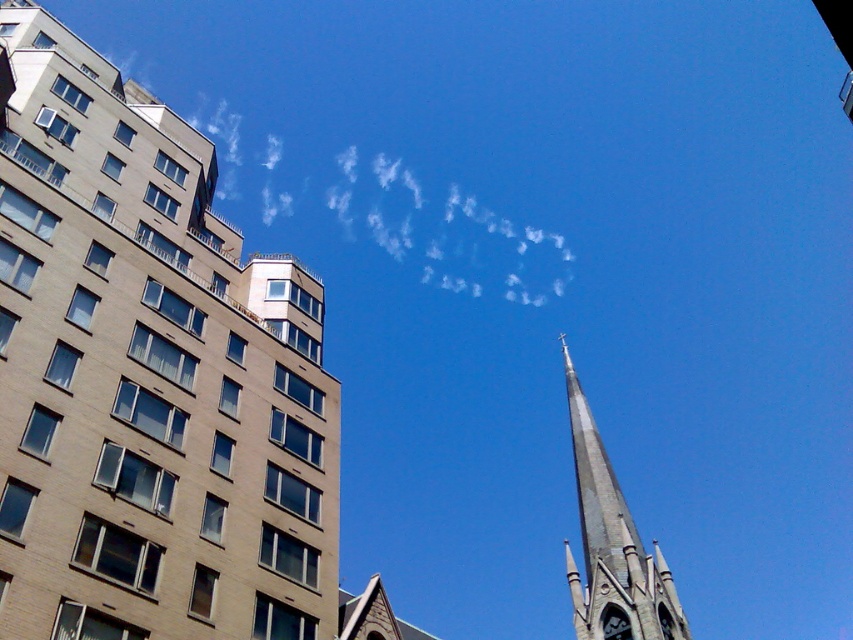
Looking at this image, between gray stone spire at center and gray stone steeple at center, which one has more height?

gray stone steeple at center is taller.

In the scene shown: Does gray stone spire at center appear on the left side of gray stone steeple at center?

Indeed, gray stone spire at center is positioned on the left side of gray stone steeple at center.

Locate an element on the screen. gray stone spire at center is located at coordinates (148, 376).

Who is taller, gray stone steeple at center or black glossy clock at upper center?

With more height is gray stone steeple at center.

Between point (654, 605) and point (604, 621), which one is positioned behind?

The point (604, 621) is more distant.

At what (x,y) coordinates should I click in order to perform the action: click on gray stone steeple at center. Please return your answer as a coordinate pair (x, y). The width and height of the screenshot is (853, 640). Looking at the image, I should click on (612, 541).

Locate an element on the screen. This screenshot has height=640, width=853. gray stone steeple at center is located at coordinates (612, 541).

Does gray stone spire at center have a greater height compared to black glossy clock at upper center?

Indeed, gray stone spire at center has a greater height compared to black glossy clock at upper center.

Can you confirm if gray stone spire at center is shorter than black glossy clock at upper center?

No, gray stone spire at center is not shorter than black glossy clock at upper center.

This screenshot has height=640, width=853. Find the location of `gray stone spire at center`. gray stone spire at center is located at coordinates (148, 376).

The image size is (853, 640). I want to click on gray stone spire at center, so click(x=148, y=376).